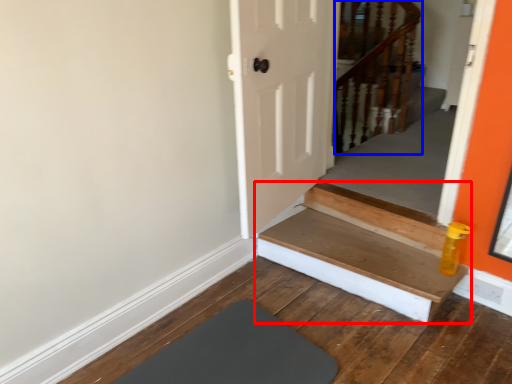
Question: Among these objects, which one is nearest to the camera, stairs (highlighted by a red box) or rail (highlighted by a blue box)?

Choices:
 (A) stairs
 (B) rail

Answer: (A)